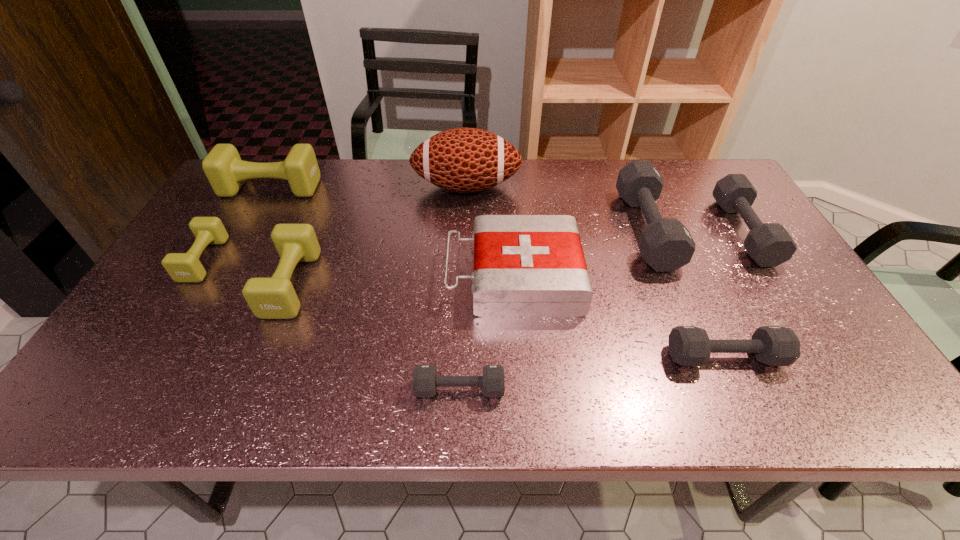
The width and height of the screenshot is (960, 540). Find the location of `object that stands as the closest to the second biggest olive dumbbell`. object that stands as the closest to the second biggest olive dumbbell is located at coordinates (186, 267).

Locate an element on the screen. the eighth closest object to the nearest gray dumbbell is located at coordinates (223, 167).

Image resolution: width=960 pixels, height=540 pixels. What are the coordinates of `dumbbell that stands as the second closest to the third biggest gray dumbbell` in the screenshot? It's located at (769, 244).

Locate which dumbbell is the seventh closest to the football. Please provide its 2D coordinates. Your answer should be formatted as a tuple, i.e. [(x, y)], where the tuple contains the x and y coordinates of a point satisfying the conditions above.

[(425, 380)]

Find the location of a particular element. This screenshot has width=960, height=540. olive dumbbell that is the closest to the first-aid kit is located at coordinates (268, 298).

Choose which olive dumbbell is the second nearest neighbor to the smallest olive dumbbell. Please provide its 2D coordinates. Your answer should be formatted as a tuple, i.e. [(x, y)], where the tuple contains the x and y coordinates of a point satisfying the conditions above.

[(223, 167)]

Point out which gray dumbbell is positioned as the nearest to the smallest olive dumbbell. Please provide its 2D coordinates. Your answer should be formatted as a tuple, i.e. [(x, y)], where the tuple contains the x and y coordinates of a point satisfying the conditions above.

[(425, 380)]

Choose which gray dumbbell is the second nearest neighbor to the rightmost dumbbell. Please provide its 2D coordinates. Your answer should be formatted as a tuple, i.e. [(x, y)], where the tuple contains the x and y coordinates of a point satisfying the conditions above.

[(688, 345)]

Where is `free spot that satisfies the following two spatial constraints: 1. on the front side of the smallest olive dumbbell; 2. on the right side of the second nearest gray dumbbell`? free spot that satisfies the following two spatial constraints: 1. on the front side of the smallest olive dumbbell; 2. on the right side of the second nearest gray dumbbell is located at coordinates (143, 356).

Identify the location of free space that satisfies the following two spatial constraints: 1. on the back side of the sixth farthest dumbbell; 2. on the right side of the shortest dumbbell. This screenshot has width=960, height=540. (461, 356).